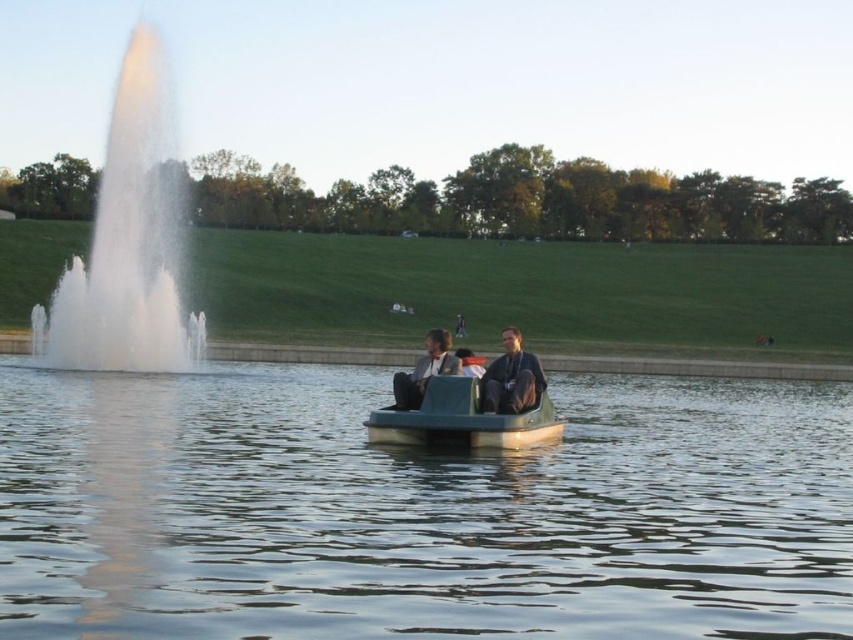
You are a photographer trying to capture the reflection of the fountain in the water. You see the green smooth water at center and the white frothy water at left. Which area would you focus on to get a clear reflection?

The green smooth water at center is positioned under white frothy water at left. Since smooth water typically provides clearer reflections, focusing on the green smooth water at center would be better for capturing the fountain reflection.

You are planning to place a small floating decoration on the water surface. Which area between the green smooth water at center and the white frothy water at left would be more stable for the decoration?

The green smooth water at center would be more stable for the decoration since it has lesser height compared to the white frothy water at left, making it calmer.